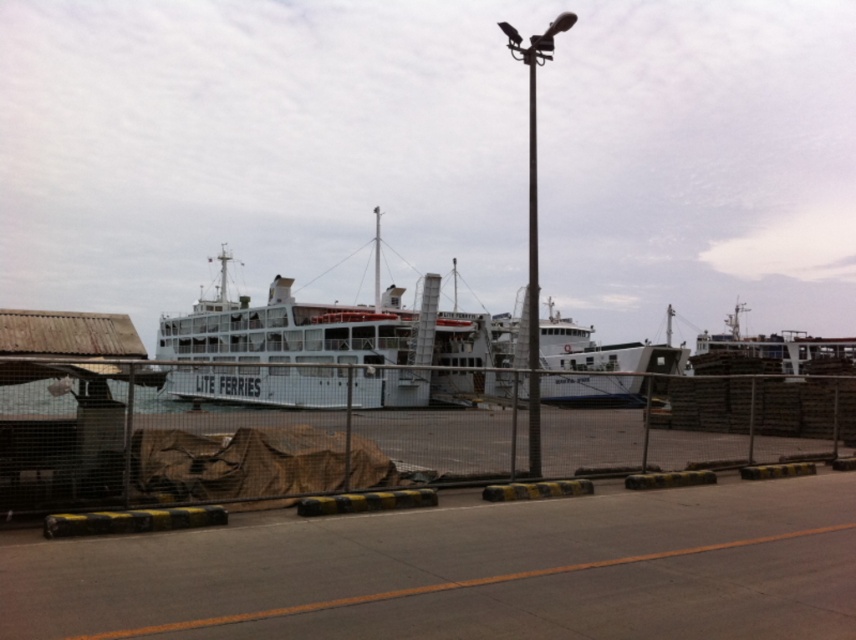
You are a harbor engineer who needs to place a new navigation buoy in the water directly in front of the white matte ferry at center. The buoy must be placed at coordinates that are exactly 0.1 units north of the ferry. What are the coordinates where you should place the buoy?

The coordinates for the new navigation buoy should be calculated by adding 0.1 to the y coordinate of the white matte ferry at center. The ferry is at point [343,349], so adding 0.1 to the y coordinate gives 0.502. Therefore, the buoy should be placed at coordinates [429,349].

You are a harbor engineer assessing the layout of the pier. You need to determine if there is enough space to move the white matte ferry at center closer to the polished metal pole at center. Based on their sizes, can the ferry be moved closer without overlapping the pole?

The white matte ferry at center occupies less space than the polished metal pole at center. Therefore, moving the ferry closer to the pole might be possible, but since the ferry is smaller in size, it depends on the available space between them. However, the description only mentions their relative sizes, not the distance between them. Without knowing the exact distance, we cannot confirm if there is enough space to move the ferry closer without overlapping the pole.

From the picture: You are a crane operator trying to lift a heavy beam that needs to be placed between the metallic pole at center and the polished metal pole at center. The beam is 5 meters long. Do you think the space between them is sufficient to fit the beam without it touching either pole?

The metallic pole at center is 4.94 meters from the polished metal pole at center. Since the beam is 5 meters long, the space between them is slightly insufficient, so the beam would not fit without touching the poles.